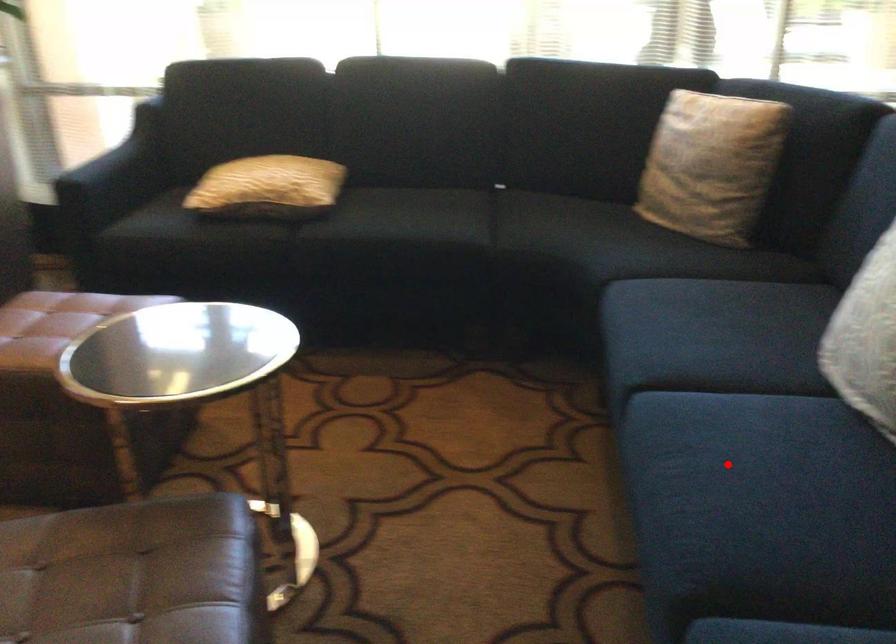
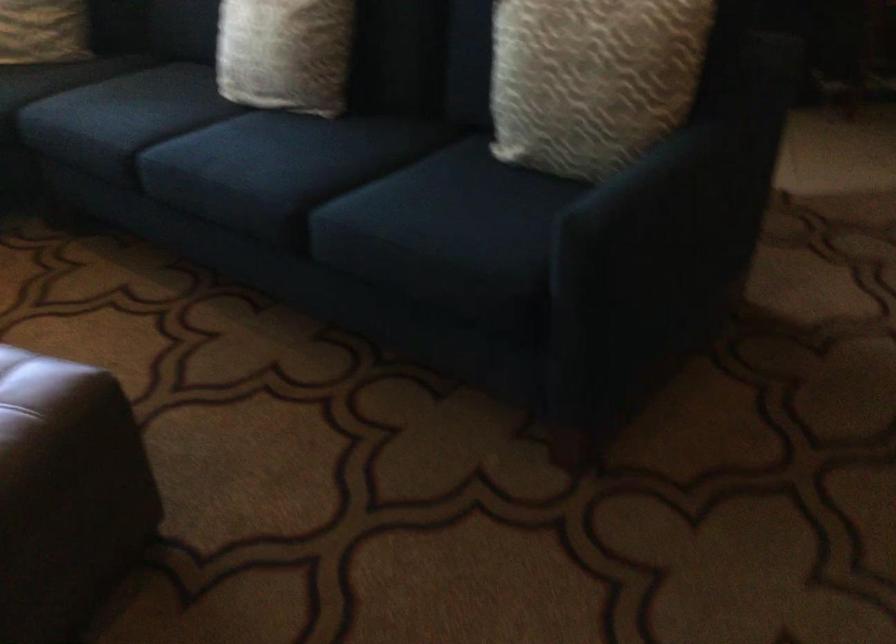
Question: I am providing you with two images of the same scene from different viewpoints. Given a red point in image1, look at the same physical point in image2. Is it:

Choices:
 (A) Closer to the viewpoint
 (B) Farther from the viewpoint

Answer: (B)